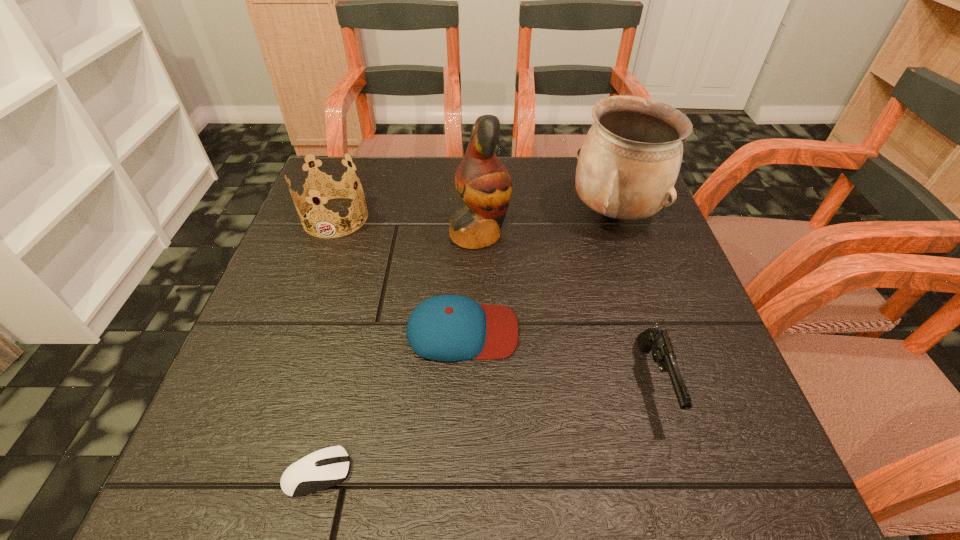
This screenshot has height=540, width=960. I want to click on vacant region located 0.050m at the end of the barrel of the gun, so click(x=681, y=463).

Where is `free spot located with the bill of the second shortest object facing forward`? The width and height of the screenshot is (960, 540). free spot located with the bill of the second shortest object facing forward is located at coordinates (661, 331).

Locate an element on the screen. This screenshot has height=540, width=960. vacant space located on the right of the mouse is located at coordinates (424, 473).

The height and width of the screenshot is (540, 960). In order to click on urn located in the far edge section of the desktop in this screenshot , I will do `click(628, 164)`.

Image resolution: width=960 pixels, height=540 pixels. Find the location of `crown located in the far edge section of the desktop`. crown located in the far edge section of the desktop is located at coordinates (326, 187).

This screenshot has width=960, height=540. What are the coordinates of `object located in the near edge section of the desktop` in the screenshot? It's located at (321, 469).

The image size is (960, 540). I want to click on crown that is at the left edge, so click(326, 187).

Identify the location of mouse that is at the left edge. (321, 469).

Locate an element on the screen. This screenshot has height=540, width=960. urn present at the right edge is located at coordinates (628, 164).

At what (x,y) coordinates should I click in order to perform the action: click on gun that is at the right edge. Please return your answer as a coordinate pair (x, y). Looking at the image, I should click on (663, 354).